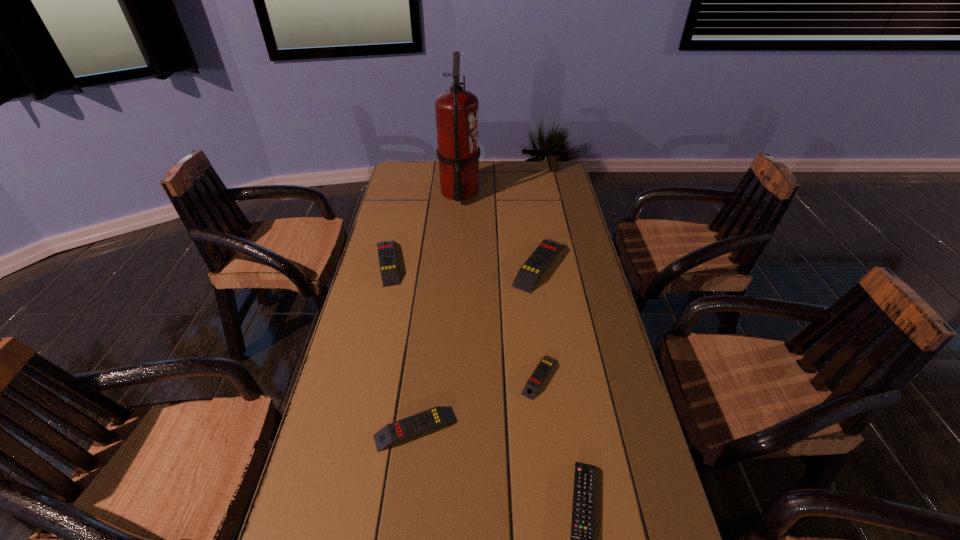
What are the coordinates of `vacant space in between the third tallest object and the farthest object` in the screenshot? It's located at (540, 218).

Locate an element on the screen. vacant region between the second smallest yellow remote control and the tallest object is located at coordinates (438, 310).

Where is `vacant space in between the second farthest object and the third farthest yellow remote control`? The height and width of the screenshot is (540, 960). vacant space in between the second farthest object and the third farthest yellow remote control is located at coordinates (500, 284).

Locate which object ranks in proximity to the nearest object. Please provide its 2D coordinates. Your answer should be formatted as a tuple, i.e. [(x, y)], where the tuple contains the x and y coordinates of a point satisfying the conditions above.

[(539, 375)]

Identify which object is the third closest to the smallest yellow remote control. Please provide its 2D coordinates. Your answer should be formatted as a tuple, i.e. [(x, y)], where the tuple contains the x and y coordinates of a point satisfying the conditions above.

[(531, 271)]

Identify the location of remote control that can be found as the third closest to the fifth farthest object. Image resolution: width=960 pixels, height=540 pixels. (531, 271).

Where is `remote control that is the closest to the fire extinguisher`? The height and width of the screenshot is (540, 960). remote control that is the closest to the fire extinguisher is located at coordinates (387, 259).

The height and width of the screenshot is (540, 960). I want to click on yellow remote control object that ranks as the second closest to the fifth farthest object, so click(531, 271).

You are a GUI agent. You are given a task and a screenshot of the screen. Output one action in this format:
    pyautogui.click(x=<x>, y=<y>)
    Task: Click on the yellow remote control that is the second closest to the smallest yellow remote control
    
    Given the screenshot: What is the action you would take?
    point(531,271)

This screenshot has width=960, height=540. In order to click on free spot that satisfies the following two spatial constraints: 1. toward the nozzle of the second farthest object; 2. on the left side of the tallest remote control in this screenshot , I will do `click(455, 265)`.